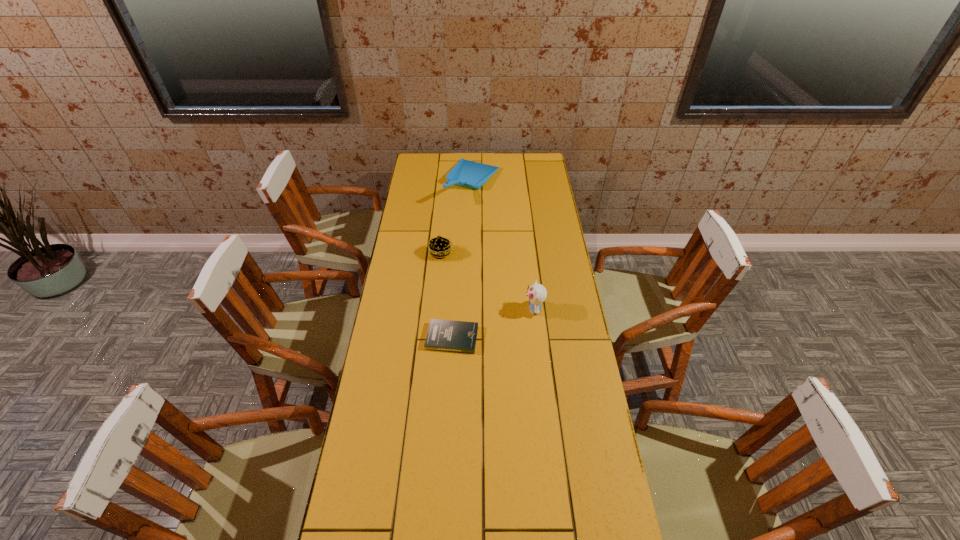
Identify the location of the farthest object. (469, 174).

Find the location of a particular element. The height and width of the screenshot is (540, 960). the rightmost object is located at coordinates (537, 293).

You are a GUI agent. You are given a task and a screenshot of the screen. Output one action in this format:
    pyautogui.click(x=<x>, y=<y>)
    Task: Click on the third farthest object
    This screenshot has width=960, height=540.
    Given the screenshot: What is the action you would take?
    pyautogui.click(x=537, y=293)

Where is `patty`? This screenshot has width=960, height=540. patty is located at coordinates (439, 247).

This screenshot has width=960, height=540. I want to click on the second shortest object, so click(x=439, y=247).

You are a GUI agent. You are given a task and a screenshot of the screen. Output one action in this format:
    pyautogui.click(x=<x>, y=<y>)
    Task: Click on the book
    
    Given the screenshot: What is the action you would take?
    pyautogui.click(x=443, y=335)

At what (x,y) coordinates should I click in order to perform the action: click on the nearest object. Please return your answer as a coordinate pair (x, y). Looking at the image, I should click on (443, 335).

Find the location of a particular element. free spot located on the left of the dustpan is located at coordinates (414, 183).

Find the location of a particular element. This screenshot has width=960, height=540. free space located on the front-facing side of the second nearest object is located at coordinates (478, 309).

Locate an element on the screen. The width and height of the screenshot is (960, 540). vacant space situated on the front-facing side of the second nearest object is located at coordinates (449, 309).